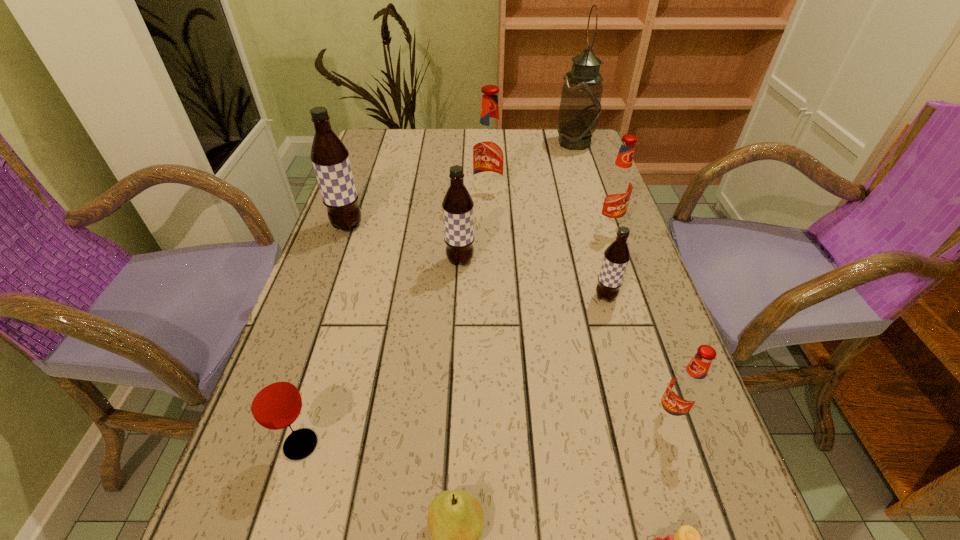
In order to click on the tallest object in this screenshot , I will do `click(580, 106)`.

Where is `oil lamp`? The image size is (960, 540). oil lamp is located at coordinates coord(580,106).

Find the location of `the second farthest object`. the second farthest object is located at coordinates (489, 149).

What are the coordinates of `the farthest red root beer` in the screenshot? It's located at (489, 149).

Locate an element on the screen. the farthest brown root beer is located at coordinates (330, 158).

You are a GUI agent. You are given a task and a screenshot of the screen. Output one action in this format:
    pyautogui.click(x=<x>, y=<y>)
    Task: Click on the biggest brown root beer
    The image size is (960, 540).
    Given the screenshot: What is the action you would take?
    pyautogui.click(x=330, y=158)

At what (x,y) coordinates should I click in order to perform the action: click on the second biggest red root beer. Please return your answer as a coordinate pair (x, y). The width and height of the screenshot is (960, 540). Looking at the image, I should click on (618, 185).

At what (x,y) coordinates should I click in order to perform the action: click on the third nearest root beer. Please return your answer as a coordinate pair (x, y). This screenshot has width=960, height=540. Looking at the image, I should click on (458, 217).

What are the coordinates of `the second brown root beer from left to right` in the screenshot? It's located at (458, 217).

This screenshot has width=960, height=540. Identify the location of the second nearest root beer. (617, 255).